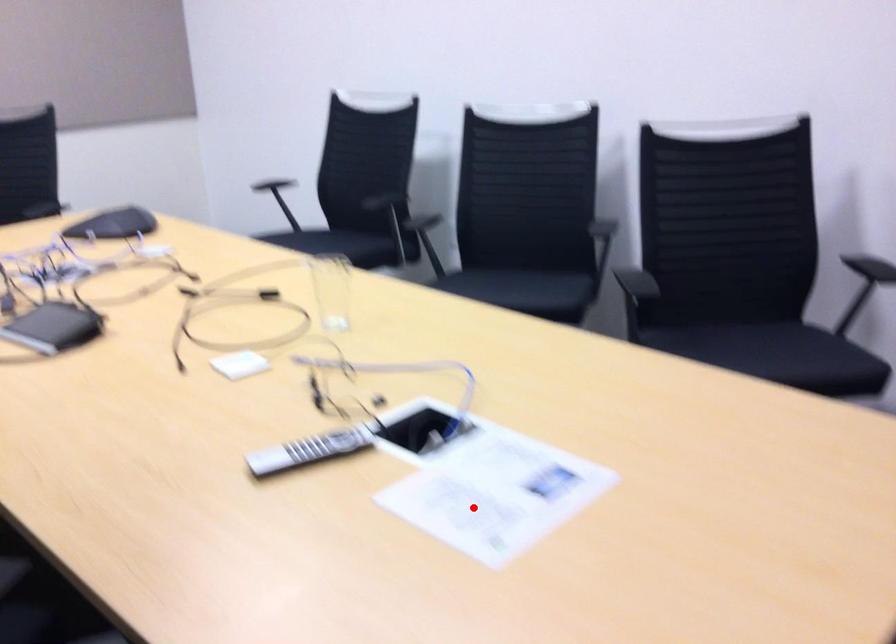
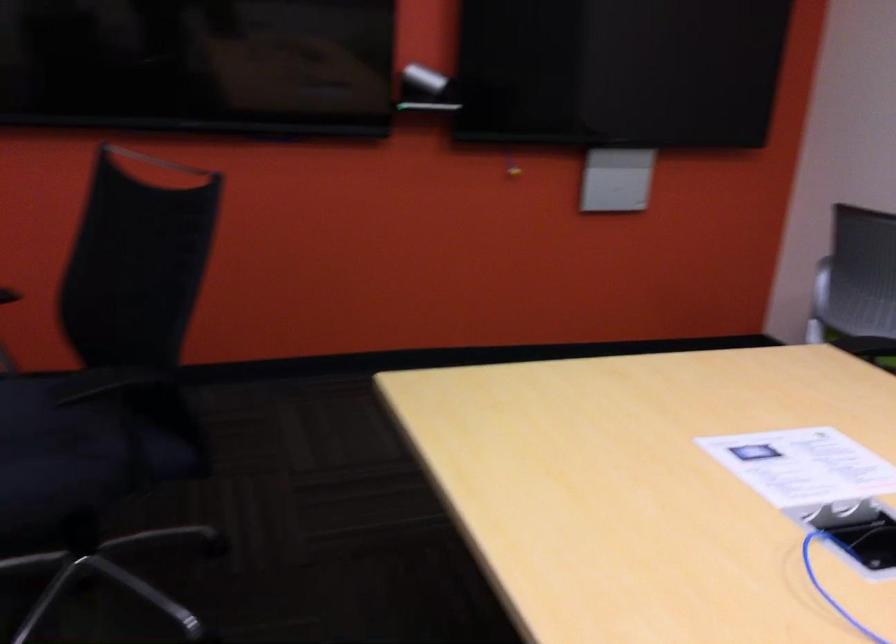
Find the pixel in the second image that matches the highlighted location in the first image.

(803, 466)